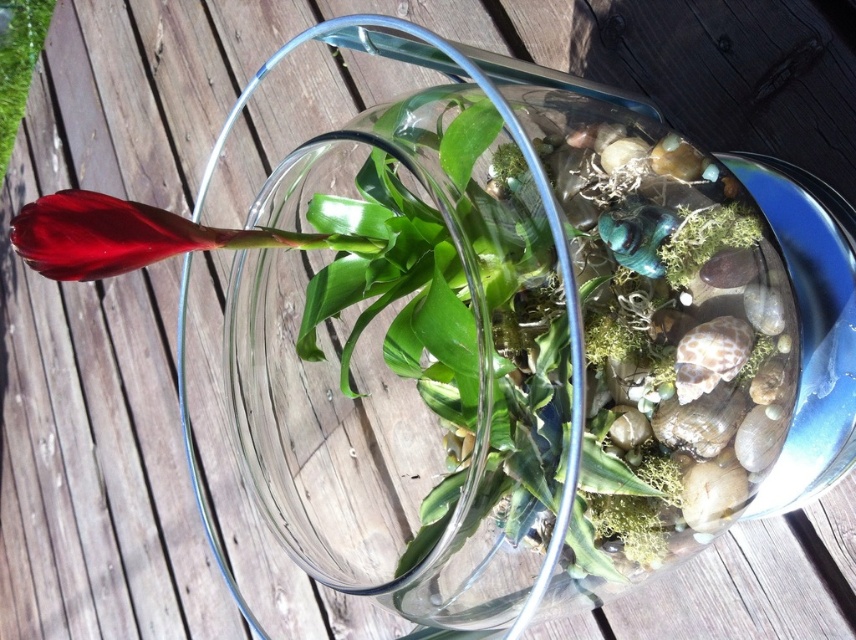
You are a gardener who wants to water the glossy red flower at left and the matte green leaf at upper left. Which one should you water first if you want to avoid getting water on the other?

You should water the glossy red flower at left first because it is in front of the matte green leaf at upper left. If you water the leaf first, water might drip onto the flower below it.

Consider the image. You are designing a miniature garden and want to place a tiny statue between the glossy red flower at left and the matte green leaf at upper left. Based on their heights, which object should the statue be placed closer to?

The glossy red flower at left is shorter than the matte green leaf at upper left. To ensure the statue is visible from both sides, it should be placed closer to the glossy red flower at left since it is shorter.